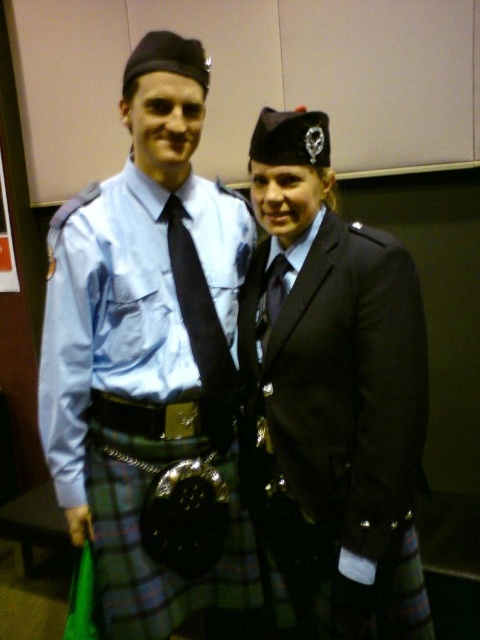
You are a photographer setting up for a group photo. You notice the matte blue shirt at center and the black silk tie at center in the frame. Which item is closer to the camera?

The matte blue shirt at center is in front of the black silk tie at center, so it is closer to the camera.

In the scene shown: You are a photographer setting up for a formal event. You need to ensure that the matte blue shirt at center and the black silk tie at center are visible in your photo. Given that your camera has a depth of field that can focus on objects within 12 centimeters of each other, will both items be in focus?

The matte blue shirt at center is 13.01 centimeters from the black silk tie at center. Since the distance exceeds the camera lens depth of field limit of 12 centimeters, only one of the items will be in focus.

You are a photographer setting up for a formal event. You need to ensure that the black satin kilt at center and the matte black tie at center are positioned so that there is at least 12 inches between them for proper lighting. Based on the current setup, is this requirement met?

The black satin kilt at center is 10.02 inches from the matte black tie at center, which is less than the required 12 inches. Therefore, the current setup does not meet the requirement, and adjustments are needed to increase the distance between them.